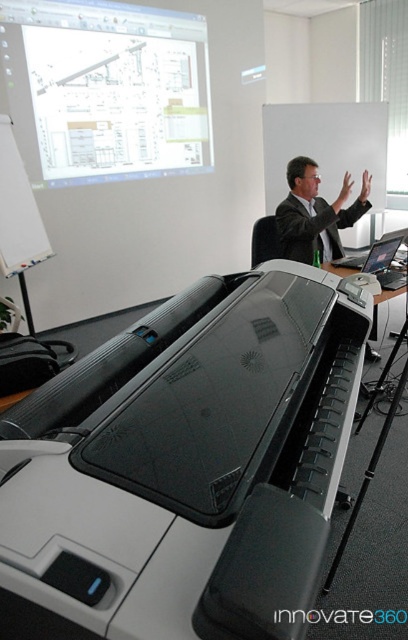
You are an office assistant who needs to place a new document on the control panel of the black plastic printer at center. From your current position at the entrance, which direction should you move to reach the printer?

The black plastic printer at center is located at point coordinates, so you should move towards the center of the room to reach it.

You are a technician standing at the back of the room. You need to adjust the settings on the black plastic printer at center, but you can only move forward in a straight line. Is there enough space between you and the dark gray suit at upper center to reach the printer without moving around any obstacles?

The black plastic printer at center and dark gray suit at upper center are 5.53 feet apart. Since you are moving in a straight line and there are no mentioned obstacles, you can reach the printer as the distance is sufficient.

You are a technician who needs to connect a USB cable from the black plastic printer at center to the computer located behind the whiteboard. The cable you have is 18 inches long. Will it reach?

The distance between the black plastic printer at center and the computer is 19.71 inches, so the 18 inches cable is too short to reach.